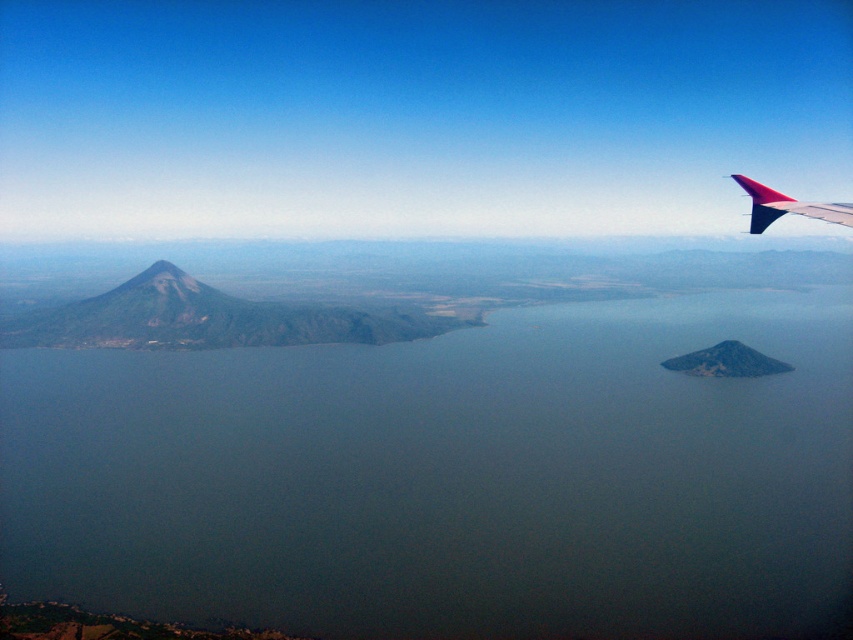
Can you confirm if green matte water at center is positioned above polished aluminum winglet at upper right?

No, green matte water at center is not above polished aluminum winglet at upper right.

Is green matte water at center smaller than polished aluminum winglet at upper right?

No.

Which is in front, point (695, 636) or point (767, 189)?

Point (767, 189) is in front.

Identify the location of green matte water at center. Image resolution: width=853 pixels, height=640 pixels. (448, 476).